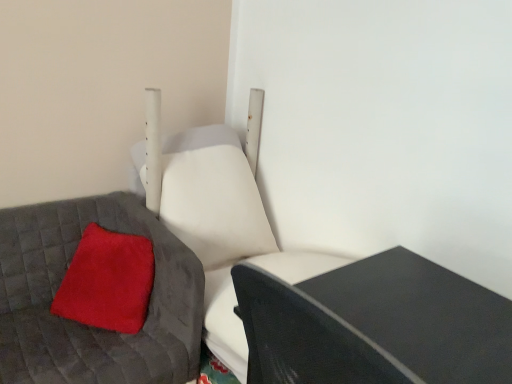
This screenshot has width=512, height=384. Describe the element at coordinates (374, 325) in the screenshot. I see `black matte table at lower right` at that location.

This screenshot has height=384, width=512. Describe the element at coordinates (218, 216) in the screenshot. I see `white leather swivel chair at center` at that location.

The image size is (512, 384). What do you see at coordinates (108, 281) in the screenshot?
I see `fuzzy red pillow at lower left` at bounding box center [108, 281].

At what (x,y) coordinates should I click in order to perform the action: click on black matte table at lower right. Please return your answer as a coordinate pair (x, y). Looking at the image, I should click on (374, 325).

Between fuzzy red pillow at lower left and velvety red pillow at left, which one appears on the left side from the viewer's perspective?

velvety red pillow at left is more to the left.

Between fuzzy red pillow at lower left and velvety red pillow at left, which one has larger width?

Wider between the two is velvety red pillow at left.

From the image's perspective, does fuzzy red pillow at lower left appear lower than velvety red pillow at left?

No.

Does fuzzy red pillow at lower left lie behind velvety red pillow at left?

That is True.

Looking at this image, considering the positions of objects white leather swivel chair at center and black matte table at lower right in the image provided, who is more to the left, white leather swivel chair at center or black matte table at lower right?

From the viewer's perspective, white leather swivel chair at center appears more on the left side.

How much distance is there between white leather swivel chair at center and black matte table at lower right?

21.55 inches.

What are the coordinates of `swivel chair on the left side of black matte table at lower right` in the screenshot? It's located at (218, 216).

From the image's perspective, does white leather swivel chair at center appear lower than black matte table at lower right?

Incorrect, from the image's perspective, white leather swivel chair at center is higher than black matte table at lower right.

From the image's perspective, is fuzzy red pillow at lower left positioned above or below black matte table at lower right?

Clearly, from the image's perspective, fuzzy red pillow at lower left is above black matte table at lower right.

Which of these two, fuzzy red pillow at lower left or black matte table at lower right, is bigger?

Bigger between the two is black matte table at lower right.

Between fuzzy red pillow at lower left and black matte table at lower right, which one has less height?

With less height is fuzzy red pillow at lower left.

Can you tell me how much black matte table at lower right and white leather swivel chair at center differ in facing direction?

91.6 degrees separate the facing orientations of black matte table at lower right and white leather swivel chair at center.

From their relative heights in the image, would you say black matte table at lower right is taller or shorter than white leather swivel chair at center?

In the image, black matte table at lower right appears to be shorter than white leather swivel chair at center.

Is black matte table at lower right oriented towards white leather swivel chair at center?

No, black matte table at lower right is not facing towards white leather swivel chair at center.

Locate an element on the screen. table that is in front of the white leather swivel chair at center is located at coordinates (374, 325).

Which object is positioned more to the right, velvety red pillow at left or white leather swivel chair at center?

Positioned to the right is white leather swivel chair at center.

Considering the sizes of velvety red pillow at left and white leather swivel chair at center in the image, is velvety red pillow at left taller or shorter than white leather swivel chair at center?

Clearly, velvety red pillow at left is shorter compared to white leather swivel chair at center.

From the picture: From a real-world perspective, is velvety red pillow at left on top of white leather swivel chair at center?

No, from a real-world perspective, velvety red pillow at left is not on top of white leather swivel chair at center.

Would you say velvety red pillow at left is a long distance from white leather swivel chair at center?

velvety red pillow at left is near white leather swivel chair at center, not far away.

Is the position of white leather swivel chair at center more distant than that of velvety red pillow at left?

That is True.

Which object is positioned more to the left, white leather swivel chair at center or velvety red pillow at left?

Positioned to the left is velvety red pillow at left.

Is point (197, 185) closer or farther from the camera than point (94, 362)?

Point (197, 185) appears to be farther away from the viewer than point (94, 362).

From a real-world perspective, who is located lower, white leather swivel chair at center or fuzzy red pillow at lower left?

fuzzy red pillow at lower left is physically lower.

Considering the sizes of white leather swivel chair at center and fuzzy red pillow at lower left in the image, is white leather swivel chair at center wider or thinner than fuzzy red pillow at lower left?

Clearly, white leather swivel chair at center has more width compared to fuzzy red pillow at lower left.

Is white leather swivel chair at center bigger or smaller than fuzzy red pillow at lower left?

Considering their sizes, white leather swivel chair at center takes up more space than fuzzy red pillow at lower left.

Considering the positions of objects white leather swivel chair at center and fuzzy red pillow at lower left in the image provided, who is more to the right, white leather swivel chair at center or fuzzy red pillow at lower left?

From the viewer's perspective, white leather swivel chair at center appears more on the right side.

What are the coordinates of `pillow that appears above the velvety red pillow at left (from a real-world perspective)` in the screenshot? It's located at (108, 281).

Locate an element on the screen. This screenshot has height=384, width=512. table located on the right of white leather swivel chair at center is located at coordinates (374, 325).

Estimate the real-world distances between objects in this image. Which object is closer to fuzzy red pillow at lower left, velvety red pillow at left or black matte table at lower right?

The object closer to fuzzy red pillow at lower left is velvety red pillow at left.

Based on their spatial positions, is black matte table at lower right or white leather swivel chair at center closer to velvety red pillow at left?

The object closer to velvety red pillow at left is white leather swivel chair at center.

When comparing their distances from white leather swivel chair at center, does velvety red pillow at left or fuzzy red pillow at lower left seem closer?

Based on the image, velvety red pillow at left appears to be nearer to white leather swivel chair at center.

When comparing their distances from fuzzy red pillow at lower left, does velvety red pillow at left or white leather swivel chair at center seem further?

The object further to fuzzy red pillow at lower left is white leather swivel chair at center.

In the scene shown: Estimate the real-world distances between objects in this image. Which object is closer to black matte table at lower right, white leather swivel chair at center or fuzzy red pillow at lower left?

Among the two, white leather swivel chair at center is located nearer to black matte table at lower right.

From the image, which object appears to be nearer to white leather swivel chair at center, black matte table at lower right or velvety red pillow at left?

velvety red pillow at left lies closer to white leather swivel chair at center than the other object.

From the image, which object appears to be farther from black matte table at lower right, velvety red pillow at left or fuzzy red pillow at lower left?

The object further to black matte table at lower right is fuzzy red pillow at lower left.

From the image, which object appears to be farther from black matte table at lower right, fuzzy red pillow at lower left or white leather swivel chair at center?

fuzzy red pillow at lower left is further to black matte table at lower right.

Locate an element on the screen. Image resolution: width=512 pixels, height=384 pixels. pillow situated between velvety red pillow at left and black matte table at lower right from left to right is located at coordinates (108, 281).

Where is `swivel chair between fuzzy red pillow at lower left and black matte table at lower right from left to right`? The width and height of the screenshot is (512, 384). swivel chair between fuzzy red pillow at lower left and black matte table at lower right from left to right is located at coordinates (218, 216).

Identify the location of pillow between velvety red pillow at left and white leather swivel chair at center in the horizontal direction. This screenshot has height=384, width=512. (108, 281).

This screenshot has height=384, width=512. I want to click on swivel chair situated between velvety red pillow at left and black matte table at lower right from left to right, so click(218, 216).